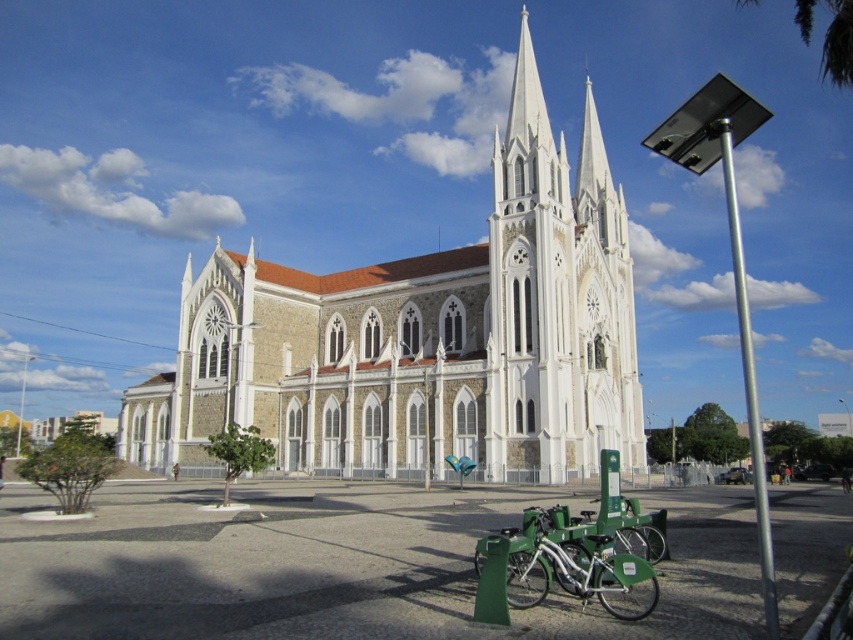
You are standing at the entrance of the church and want to locate the white stone church at center. Based on its coordinates, where exactly is it positioned?

The white stone church at center is positioned at coordinates point (422, 337).

You are standing in front of the church and want to take a photo of the silver metallic pole at right and the green matte bicycle at lower center. Which object should you focus on first if you want both to be in clear focus?

The silver metallic pole at right is closer to the viewer than the green matte bicycle at lower center, so you should focus on the silver metallic pole at right first to ensure both are in clear focus.